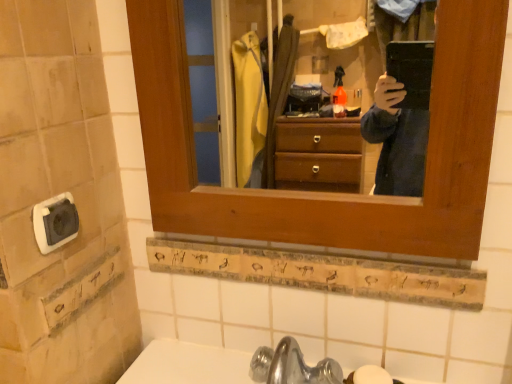
Question: From the image's perspective, is white matte soap at lower center located beneath white plastic outlet at lower left?

Choices:
 (A) yes
 (B) no

Answer: (A)

Question: Is white matte soap at lower center oriented away from white plastic outlet at lower left?

Choices:
 (A) yes
 (B) no

Answer: (B)

Question: Is white matte soap at lower center further to camera compared to white plastic outlet at lower left?

Choices:
 (A) yes
 (B) no

Answer: (A)

Question: Considering the relative sizes of white matte soap at lower center and white plastic outlet at lower left in the image provided, is white matte soap at lower center shorter than white plastic outlet at lower left?

Choices:
 (A) no
 (B) yes

Answer: (B)

Question: Considering the relative sizes of white matte soap at lower center and white plastic outlet at lower left in the image provided, is white matte soap at lower center thinner than white plastic outlet at lower left?

Choices:
 (A) yes
 (B) no

Answer: (B)

Question: Is white matte soap at lower center placed right next to white plastic outlet at lower left?

Choices:
 (A) yes
 (B) no

Answer: (B)

Question: Can you see white plastic outlet at lower left touching white matte soap at lower center?

Choices:
 (A) no
 (B) yes

Answer: (A)

Question: Would you say white matte soap at lower center is part of white plastic outlet at lower left's contents?

Choices:
 (A) yes
 (B) no

Answer: (B)

Question: Is white plastic outlet at lower left completely or partially outside of white matte soap at lower center?

Choices:
 (A) no
 (B) yes

Answer: (B)

Question: Considering the relative sizes of white plastic outlet at lower left and white matte soap at lower center in the image provided, is white plastic outlet at lower left wider than white matte soap at lower center?

Choices:
 (A) no
 (B) yes

Answer: (A)

Question: Could you tell me if white plastic outlet at lower left is facing white matte soap at lower center?

Choices:
 (A) no
 (B) yes

Answer: (A)

Question: Is white plastic outlet at lower left positioned with its back to white matte soap at lower center?

Choices:
 (A) yes
 (B) no

Answer: (B)

Question: In the image, is white plastic outlet at lower left positioned in front of or behind white matte soap at lower center?

Choices:
 (A) front
 (B) behind

Answer: (A)